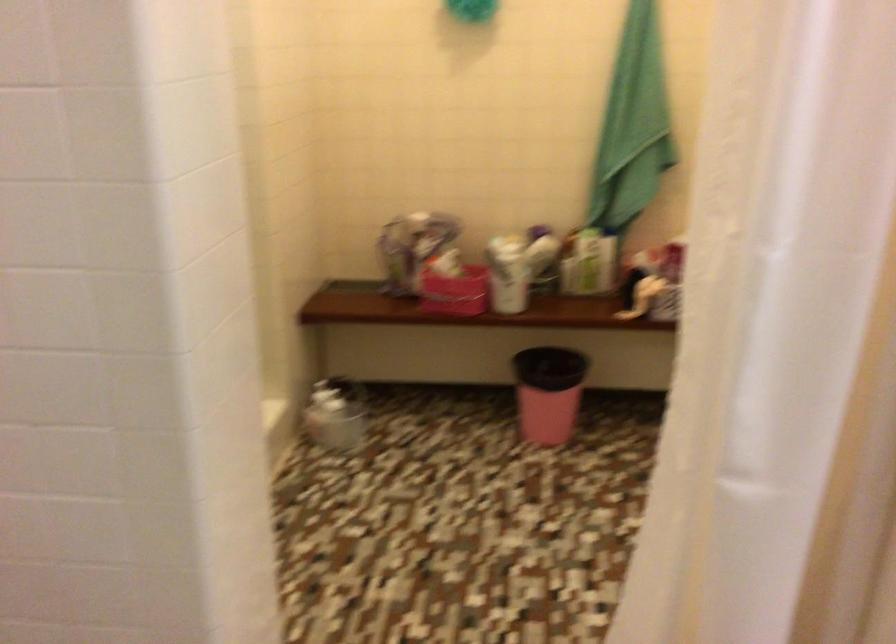
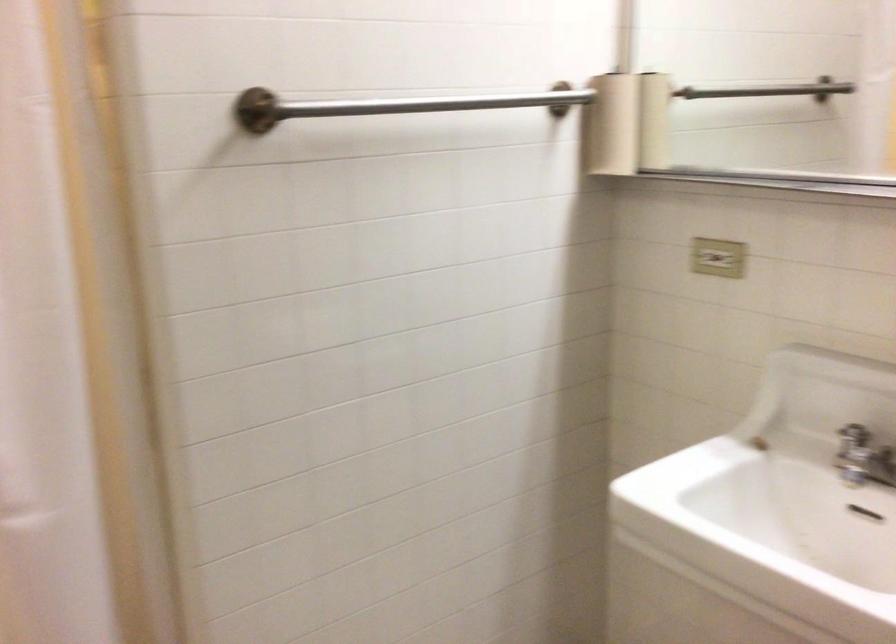
Question: The camera is either moving clockwise (left) or counter-clockwise (right) around the object. The first image is from the beginning of the video and the second image is from the end. Is the camera moving left or right when shooting the video?

Choices:
 (A) Left
 (B) Right

Answer: (A)